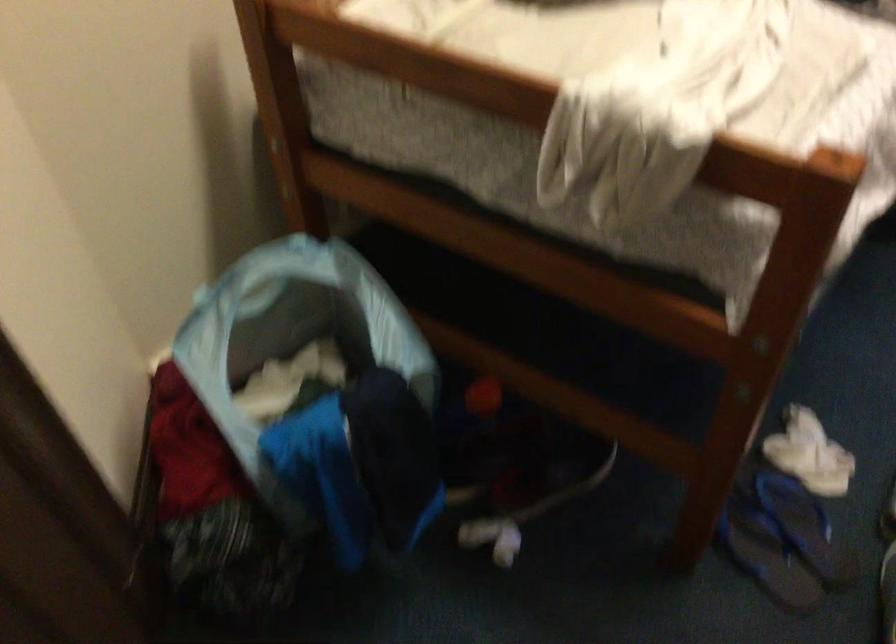
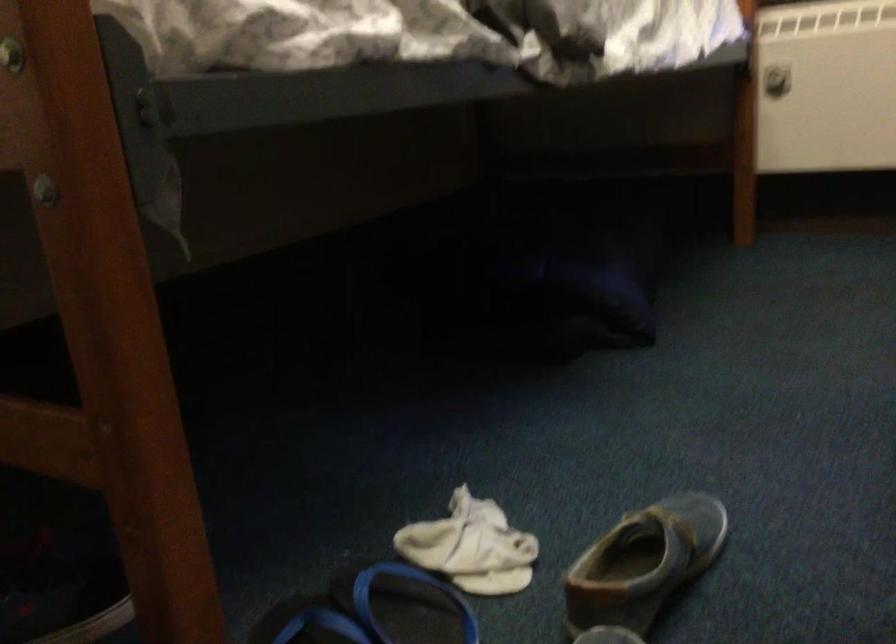
Question: How did the camera likely rotate?

Choices:
 (A) Left
 (B) Right
 (C) Up
 (D) Down

Answer: (C)